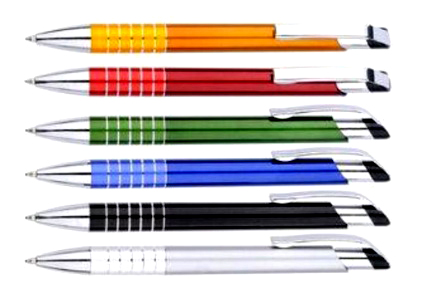
Where is `pens`? Image resolution: width=434 pixels, height=303 pixels. pens is located at coordinates (186, 39), (181, 80), (192, 127), (197, 169), (193, 219), (193, 268).